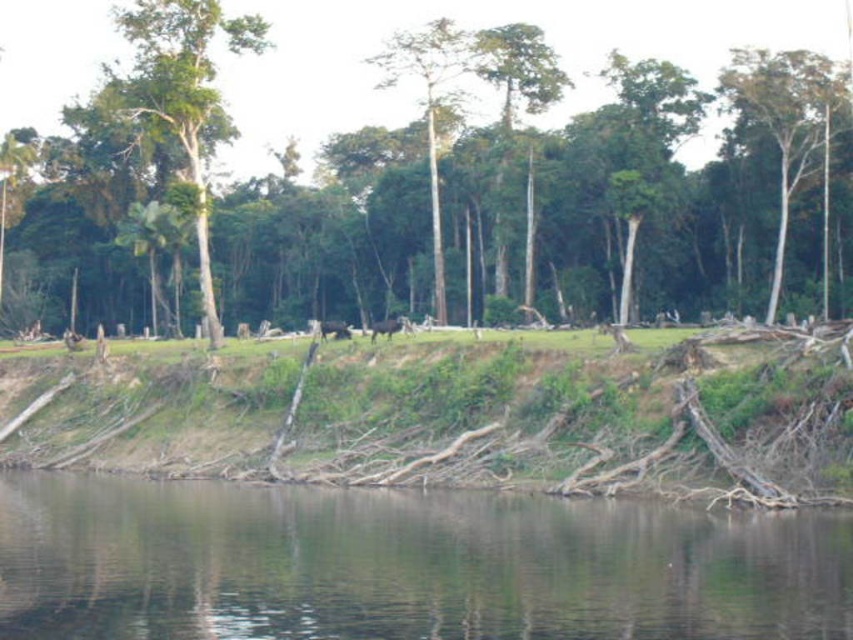
Question: Estimate the real-world distances between objects in this image. Which object is closer to the smooth bark tree at center?

Choices:
 (A) brown furry animal at center
 (B) green leafy tree at center
 (C) white smooth tree at upper right
 (D) dark brown water at lower center

Answer: (B)

Question: Does brown dirt river bank at center have a larger size compared to white smooth tree at upper right?

Choices:
 (A) no
 (B) yes

Answer: (A)

Question: Which object is positioned closest to the brown furry animal at center?

Choices:
 (A) smooth bark tree at center
 (B) brown fur animal at center

Answer: (B)

Question: Where is dark brown water at lower center located in relation to green leafy tree at center in the image?

Choices:
 (A) right
 (B) left

Answer: (B)

Question: Among these points, which one is nearest to the camera?

Choices:
 (A) (332, 326)
 (B) (809, 92)
 (C) (149, 541)
 (D) (387, 320)

Answer: (C)

Question: Is white smooth tree at upper right thinner than brown furry animal at center?

Choices:
 (A) yes
 (B) no

Answer: (B)